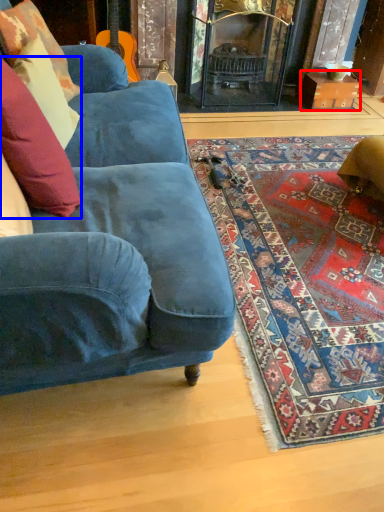
Question: Which object is further to the camera taking this photo, cardboard box (highlighted by a red box) or pillow (highlighted by a blue box)?

Choices:
 (A) cardboard box
 (B) pillow

Answer: (A)